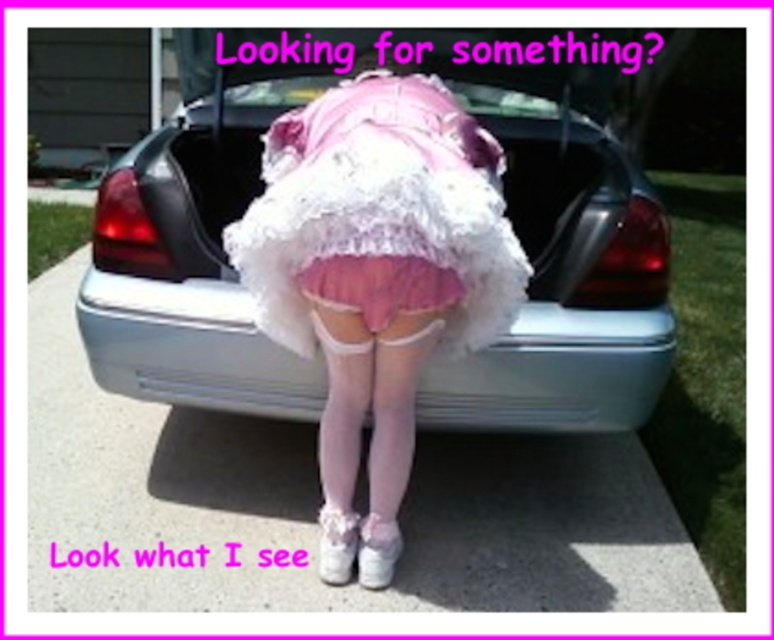
Question: Is fuzzy white skirt at center behind pink satin ballet skirt at center?

Choices:
 (A) no
 (B) yes

Answer: (A)

Question: Based on their relative distances, which object is farther from the pink satin ballet skirt at center?

Choices:
 (A) white glossy sedan at center
 (B) fuzzy white skirt at center

Answer: (A)

Question: Which object is positioned closest to the pink satin ballet skirt at center?

Choices:
 (A) white glossy sedan at center
 (B) fuzzy white skirt at center

Answer: (B)

Question: In this image, where is fuzzy white skirt at center located relative to pink satin ballet skirt at center?

Choices:
 (A) left
 (B) right

Answer: (B)

Question: Which point is closer to the camera taking this photo?

Choices:
 (A) (447, 124)
 (B) (457, 284)

Answer: (B)

Question: Can you confirm if white glossy sedan at center is thinner than pink satin ballet skirt at center?

Choices:
 (A) no
 (B) yes

Answer: (A)